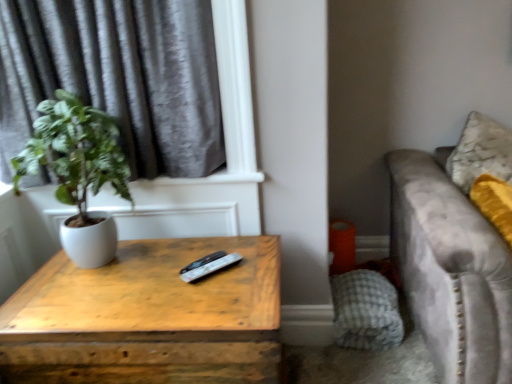
Question: Considering the relative sizes of wooden table at center and gray velvet curtain at upper left in the image provided, is wooden table at center taller than gray velvet curtain at upper left?

Choices:
 (A) no
 (B) yes

Answer: (A)

Question: From a real-world perspective, is wooden table at center over gray velvet curtain at upper left?

Choices:
 (A) no
 (B) yes

Answer: (A)

Question: Considering the relative sizes of wooden table at center and gray velvet curtain at upper left in the image provided, is wooden table at center thinner than gray velvet curtain at upper left?

Choices:
 (A) yes
 (B) no

Answer: (B)

Question: From a real-world perspective, is wooden table at center below gray velvet curtain at upper left?

Choices:
 (A) yes
 (B) no

Answer: (A)

Question: Is wooden table at center turned away from gray velvet curtain at upper left?

Choices:
 (A) yes
 (B) no

Answer: (B)

Question: Is velvet gray couch at right inside the boundaries of gray velvet curtain at upper left, or outside?

Choices:
 (A) inside
 (B) outside

Answer: (B)

Question: Is velvet gray couch at right in front of or behind gray velvet curtain at upper left in the image?

Choices:
 (A) behind
 (B) front

Answer: (B)

Question: Considering the relative positions of velvet gray couch at right and gray velvet curtain at upper left in the image provided, is velvet gray couch at right to the left or to the right of gray velvet curtain at upper left?

Choices:
 (A) left
 (B) right

Answer: (B)

Question: Does point (445, 183) appear closer or farther from the camera than point (145, 46)?

Choices:
 (A) closer
 (B) farther

Answer: (B)

Question: Looking at their shapes, would you say white matte pot at left is wider or thinner than gray checkered pillow at lower right?

Choices:
 (A) wide
 (B) thin

Answer: (A)

Question: Is point (89, 249) positioned closer to the camera than point (352, 296)?

Choices:
 (A) farther
 (B) closer

Answer: (B)

Question: Based on their positions, is white matte pot at left located to the left or right of gray checkered pillow at lower right?

Choices:
 (A) right
 (B) left

Answer: (B)

Question: Which is correct: white matte pot at left is inside gray checkered pillow at lower right, or outside of it?

Choices:
 (A) outside
 (B) inside

Answer: (A)

Question: Is black plastic remote at center inside the boundaries of gray velvet curtain at upper left, or outside?

Choices:
 (A) inside
 (B) outside

Answer: (B)

Question: Is black plastic remote at center bigger or smaller than gray velvet curtain at upper left?

Choices:
 (A) big
 (B) small

Answer: (B)